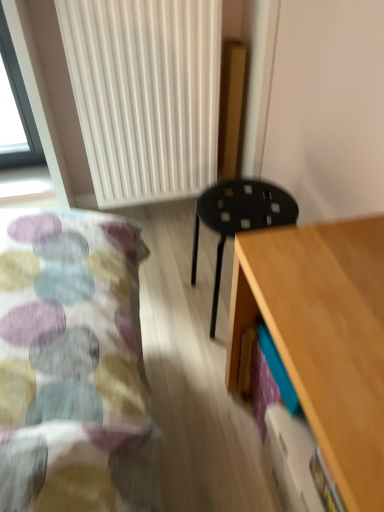
Question: Is light wood desk at lower right spatially inside black plastic stool at center, or outside of it?

Choices:
 (A) outside
 (B) inside

Answer: (A)

Question: Based on their positions, is light wood desk at lower right located to the left or right of black plastic stool at center?

Choices:
 (A) left
 (B) right

Answer: (B)

Question: Which of these objects is positioned farthest from the light wood desk at lower right?

Choices:
 (A) black plastic stool at center
 (B) white ribbed radiator at upper center

Answer: (B)

Question: Which of these objects is positioned farthest from the black plastic stool at center?

Choices:
 (A) light wood desk at lower right
 (B) white ribbed radiator at upper center

Answer: (B)